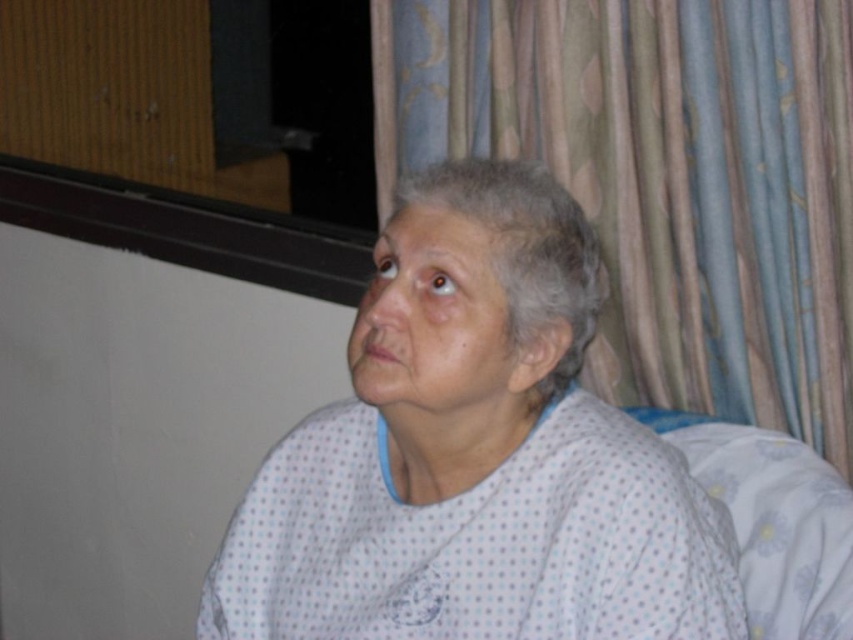
You are a nurse checking the patient in the hospital room. You notice the white dotted fabric at center and the blue textured curtain at upper right. Which object is larger in size?

The blue textured curtain at upper right is larger in size compared to the white dotted fabric at center.

You are a nurse checking on a patient in a hospital room. You notice the white dotted fabric at center and the blue textured curtain at upper right. Which object is located to the left of the other?

The white dotted fabric at center is positioned on the left side of blue textured curtain at upper right.